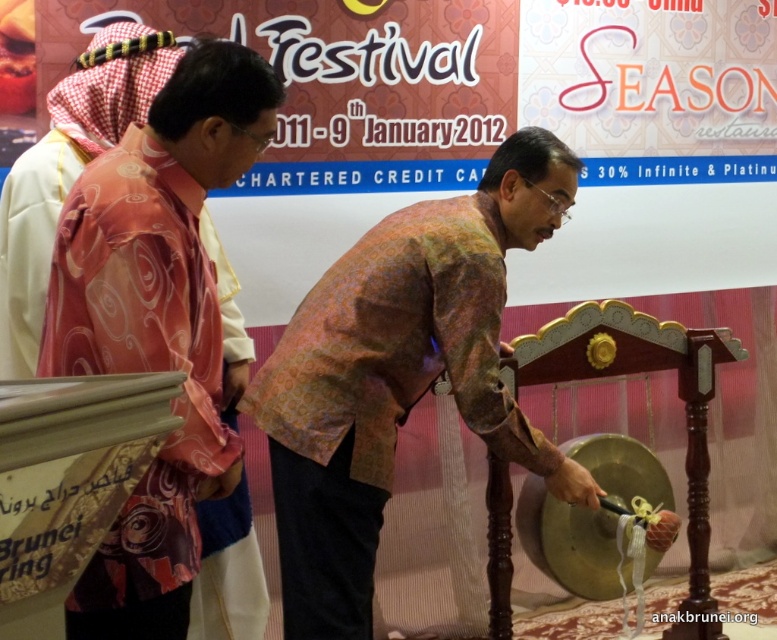
Question: Does multicolored batik shirt at center appear on the right side of pink satin robe at left?

Choices:
 (A) no
 (B) yes

Answer: (B)

Question: Observing the image, what is the correct spatial positioning of multicolored batik shirt at center in reference to pink satin robe at left?

Choices:
 (A) below
 (B) above

Answer: (A)

Question: Which point is closer to the camera?

Choices:
 (A) multicolored batik shirt at center
 (B) pink satin robe at left

Answer: (B)

Question: Which of the following is the closest to the observer?

Choices:
 (A) multicolored batik shirt at center
 (B) pink satin robe at left

Answer: (B)

Question: Observing the image, what is the correct spatial positioning of multicolored batik shirt at center in reference to pink satin robe at left?

Choices:
 (A) right
 (B) left

Answer: (A)